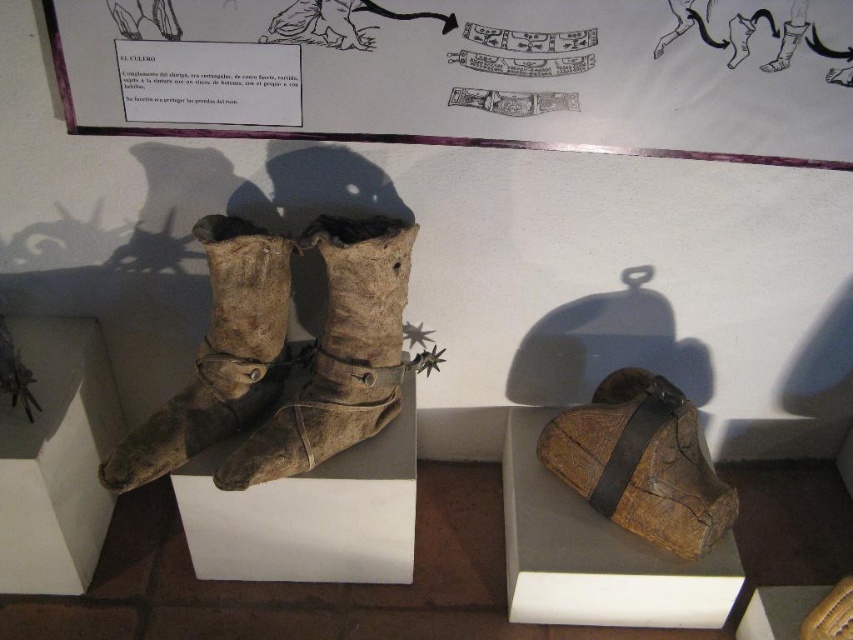
You are a museum visitor standing in front of the display. You want to take a photo of the brown leather boot at center without any obstruction. Is the brown leather box at lower left blocking your view of the boot?

The brown leather boot at center is behind the brown leather box at lower left, so the box is blocking the view of the boot. To take an unobstructed photo, you would need to move around the box or adjust your angle to see the boot without the box in front of it.

In the scene shown: You are a museum curator planning to install a new display case between the worn leather boots at center and the point at coordinate (338, 355). Will the display case fit if it requires a minimum of 0.6 meters of space between the two points?

The worn leather boots at center is represented by point (338, 355), so the distance between them is zero. Therefore, the display case requiring 0.6 meters of space cannot fit.

You are a museum visitor standing in front of the display. You notice the white paper bulletin board at upper center and the worn leather boots at center. According to the exhibit layout, which object is positioned to the right of the other?

The white paper bulletin board at upper center is to the right of the worn leather boots at center.